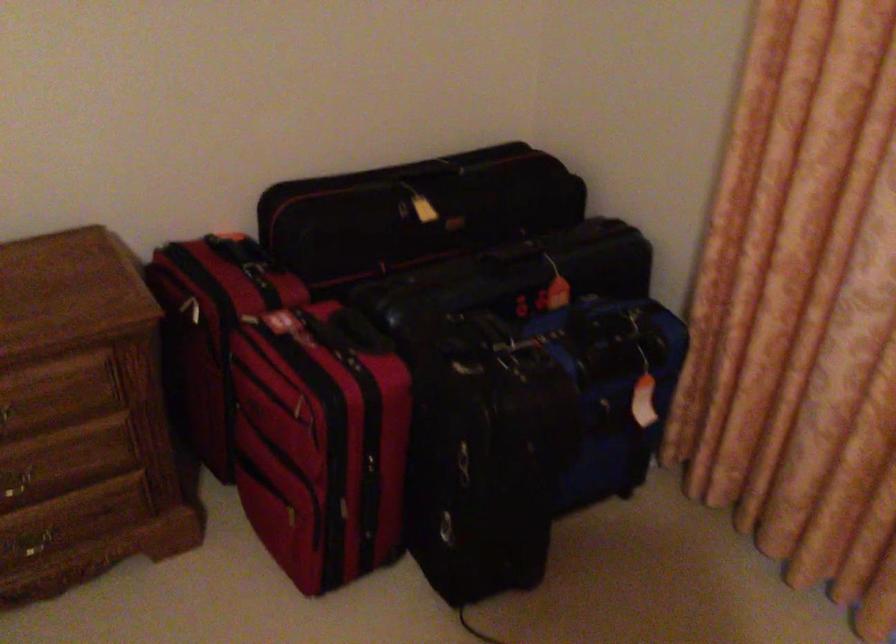
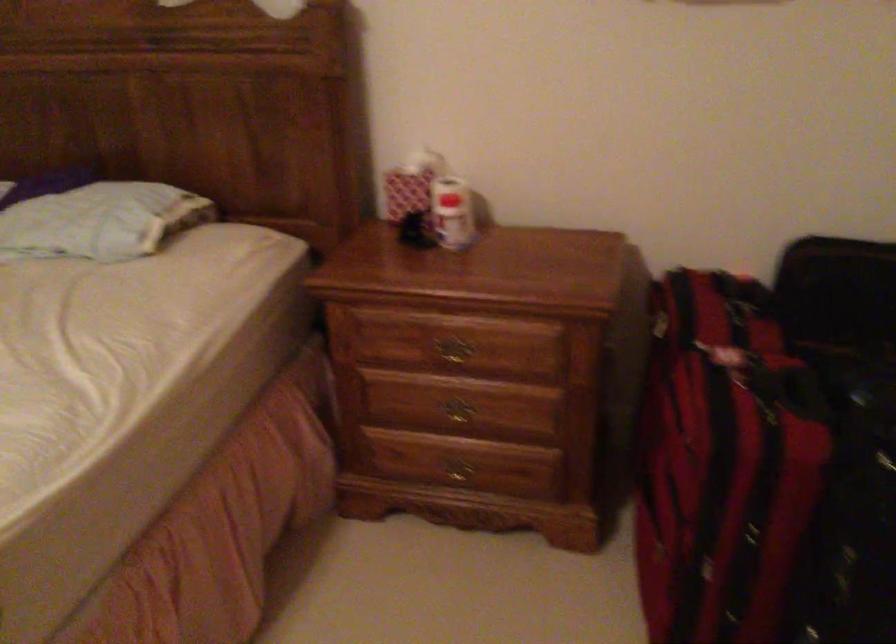
Question: Based on the continuous images, in which direction is the camera rotating? Reply with the corresponding letter.

Choices:
 (A) Left
 (B) Right
 (C) Up
 (D) Down

Answer: (A)